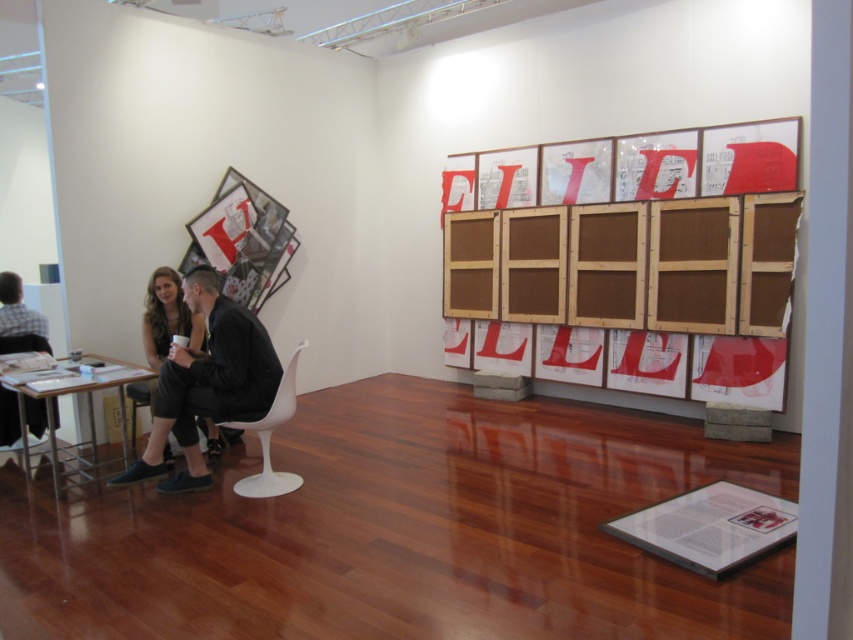
You are an art gallery attendant and need to determine which of the two items, the black leather jacket at left or the matte black dress at lower left, requires more storage space. Based on the description, which one should you allocate more space for?

The black leather jacket at left is larger in size than the matte black dress at lower left, so you should allocate more storage space for the black leather jacket at left.

Looking at this image, you are an art enthusiast standing in the gallery and see the metallic silver table at lower left and the matte black dress at lower left. Which object is positioned more to the left side of the scene?

The metallic silver table at lower left is positioned to the left of the matte black dress at lower left, so the metallic silver table at lower left is more to the left.

You are an art gallery visitor standing in the center of the room. You want to take a closer look at both the black leather jacket at left and the matte black dress at lower left. Which one should you move towards first to see the closest object?

You should move towards the black leather jacket at left first because it is closer to you than the matte black dress at lower left.